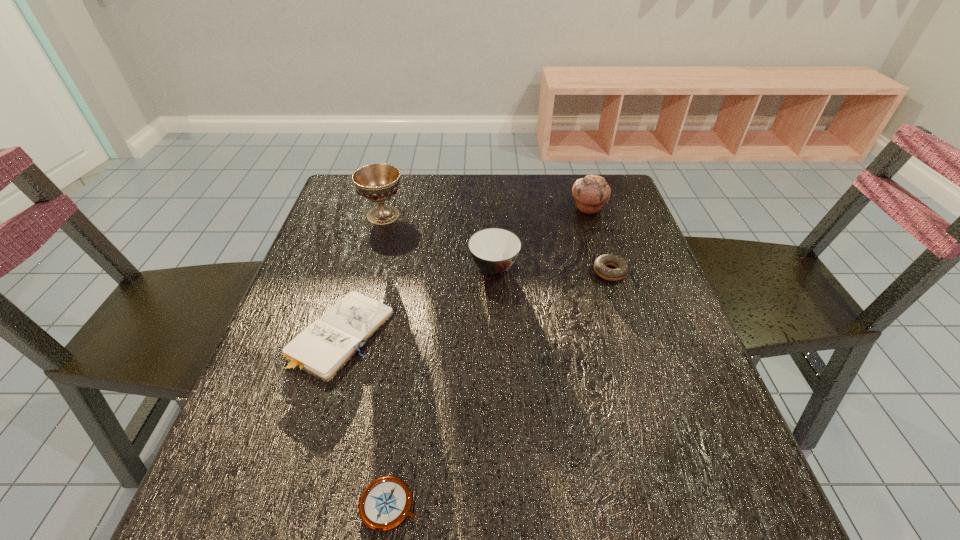
Find the location of a particular element. The width and height of the screenshot is (960, 540). the tallest object is located at coordinates (377, 182).

At what (x,y) coordinates should I click in order to perform the action: click on the fifth shortest object. Please return your answer as a coordinate pair (x, y). Looking at the image, I should click on (591, 193).

The width and height of the screenshot is (960, 540). In order to click on the third tallest object in this screenshot , I will do `click(494, 250)`.

Locate an element on the screen. the fourth object from left to right is located at coordinates click(494, 250).

Where is `the third shortest object`? the third shortest object is located at coordinates (622, 268).

Identify the location of notebook. (325, 346).

I want to click on the fifth farthest object, so click(x=325, y=346).

This screenshot has height=540, width=960. In order to click on the nearest object in this screenshot , I will do `click(385, 503)`.

Locate an element on the screen. This screenshot has height=540, width=960. compass is located at coordinates (385, 503).

At what (x,y) coordinates should I click in order to perform the action: click on free space located on the right of the tallest object. Please return your answer as a coordinate pair (x, y). The width and height of the screenshot is (960, 540). Looking at the image, I should click on [519, 215].